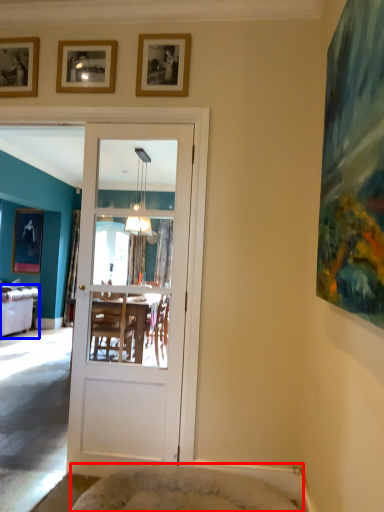
Question: Which of the following is the farthest to the observer, cat bed (highlighted by a red box) or studio couch (highlighted by a blue box)?

Choices:
 (A) cat bed
 (B) studio couch

Answer: (B)